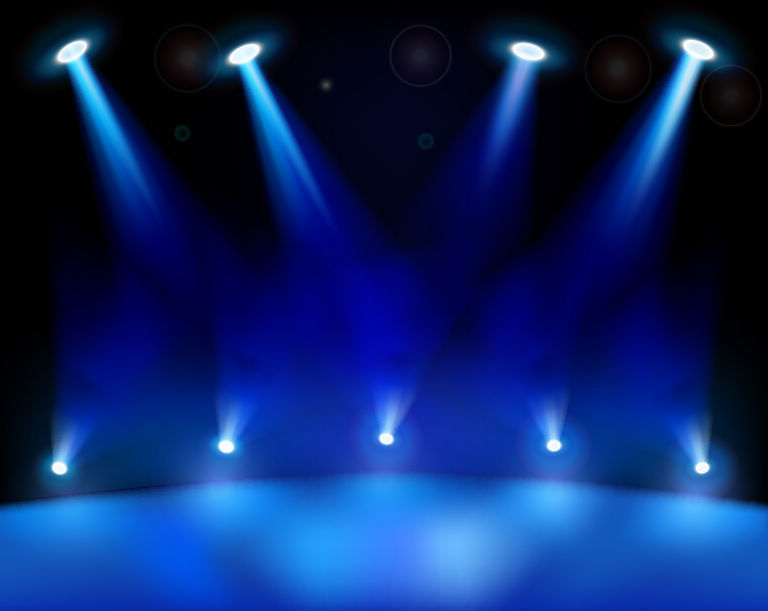
Where is `spotlights`? This screenshot has height=611, width=768. spotlights is located at coordinates (55, 470), (71, 45), (227, 447), (239, 49), (384, 437), (525, 49), (558, 441), (702, 46), (696, 469).